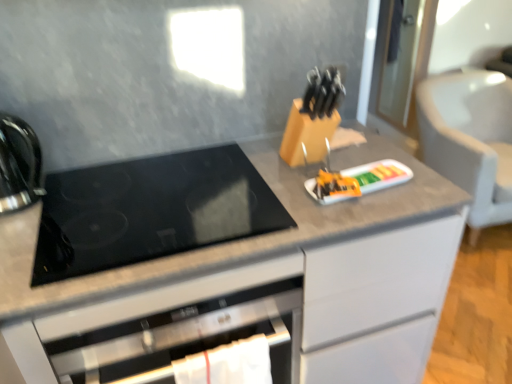
Locate an element on the screen. The height and width of the screenshot is (384, 512). vacant area on the back side of orange plastic tray at center is located at coordinates (350, 156).